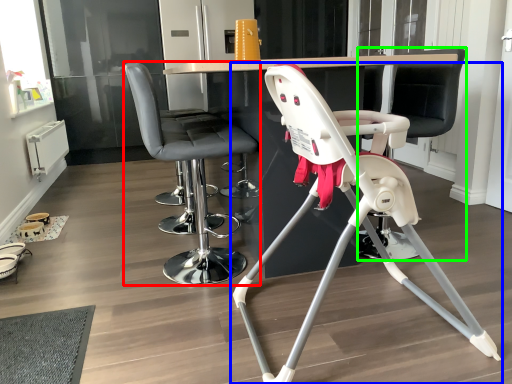
Question: Based on their relative distances, which object is nearer to chair (highlighted by a red box)? Choose from chair (highlighted by a blue box) and swivel chair (highlighted by a green box).

Choices:
 (A) chair
 (B) swivel chair

Answer: (A)